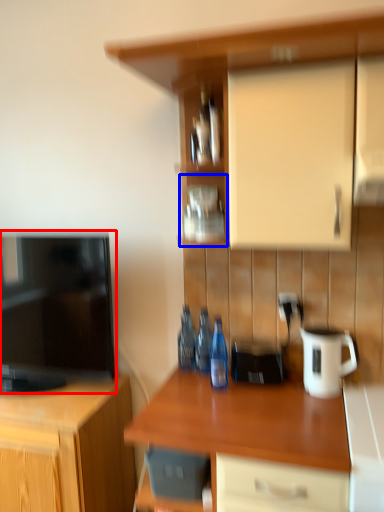
Question: Which of the following is the farthest to the observer, television (highlighted by a red box) or shelf (highlighted by a blue box)?

Choices:
 (A) television
 (B) shelf

Answer: (B)